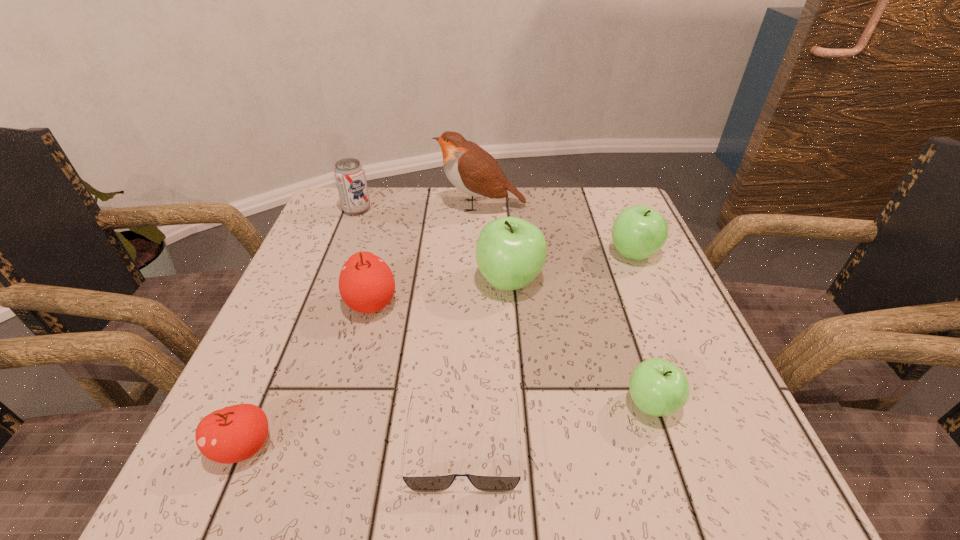
Locate an element on the screen. The image size is (960, 540). free area in between the farther red apple and the nearest green apple is located at coordinates (512, 354).

The width and height of the screenshot is (960, 540). What are the coordinates of `empty space that is in between the second biggest green apple and the leftmost apple` in the screenshot? It's located at (439, 350).

Where is `free area in between the nearer red apple and the second smallest green apple`? free area in between the nearer red apple and the second smallest green apple is located at coordinates (439, 350).

Locate an element on the screen. The height and width of the screenshot is (540, 960). vacant space that's between the smallest green apple and the tallest apple is located at coordinates (581, 343).

Find the location of a particular element. vacant point located between the bird and the shortest object is located at coordinates (472, 324).

Find the location of a particular element. vacant area between the smaller red apple and the second smallest green apple is located at coordinates (439, 350).

Find the location of a particular element. free space between the brown bird and the beer can is located at coordinates (419, 207).

Point out which object is positioned as the third nearest to the nearest green apple. Please provide its 2D coordinates. Your answer should be formatted as a tuple, i.e. [(x, y)], where the tuple contains the x and y coordinates of a point satisfying the conditions above.

[(638, 232)]

In order to click on object identified as the sixth closest to the right red apple in this screenshot , I will do `click(657, 387)`.

Select which apple is the second closest to the second biggest green apple. Please provide its 2D coordinates. Your answer should be formatted as a tuple, i.e. [(x, y)], where the tuple contains the x and y coordinates of a point satisfying the conditions above.

[(657, 387)]